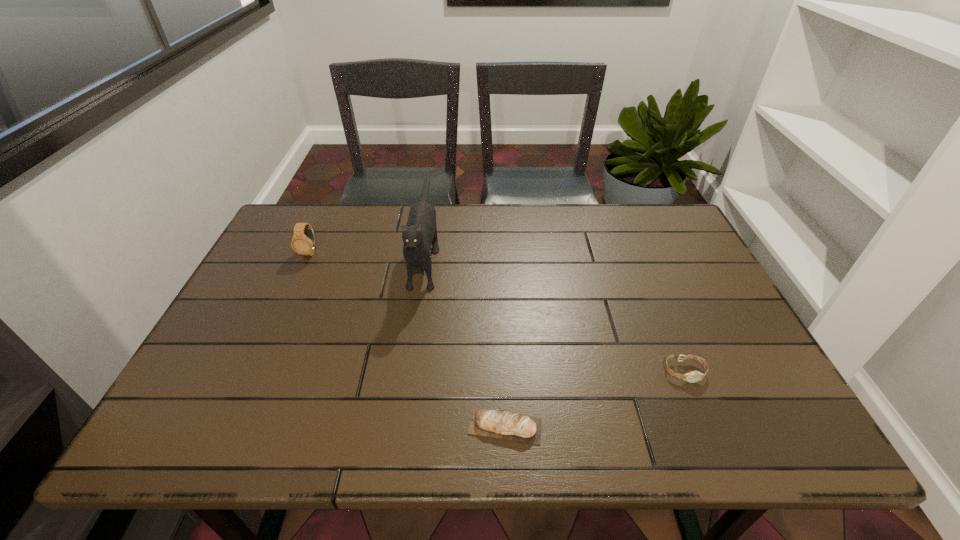
At what (x,y) coordinates should I click in order to perform the action: click on free space at the left edge of the desktop. Please return your answer as a coordinate pair (x, y). Looking at the image, I should click on (281, 255).

The image size is (960, 540). Identify the location of vacant area at the right edge of the desktop. (715, 298).

Find the location of a particular element. free space at the far left corner of the desktop is located at coordinates (322, 213).

You are a GUI agent. You are given a task and a screenshot of the screen. Output one action in this format:
    pyautogui.click(x=<x>, y=<y>)
    Task: Click on the free space at the far right corner of the desktop
    This screenshot has width=960, height=540.
    Given the screenshot: What is the action you would take?
    pyautogui.click(x=678, y=227)

Find the location of a particular element. unoccupied position between the tallest object and the third object from left to right is located at coordinates (466, 340).

Locate an element on the screen. The height and width of the screenshot is (540, 960). blank region between the tallest object and the third farthest object is located at coordinates (555, 313).

Where is `vacant point located between the tallest object and the pita bread`? vacant point located between the tallest object and the pita bread is located at coordinates [x=466, y=340].

The image size is (960, 540). I want to click on free space between the nearest object and the third farthest object, so click(594, 399).

Identify the location of free spot between the second nearest object and the leftmost object. click(x=497, y=312).

The width and height of the screenshot is (960, 540). In order to click on free area in between the rightmost object and the third object from left to right in this screenshot , I will do `click(594, 399)`.